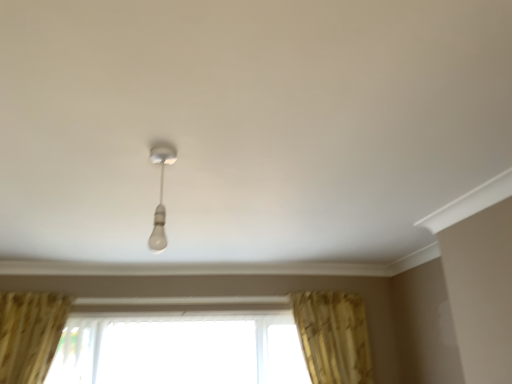
Question: Does white glossy bulb at center have a lesser width compared to transparent glass window at center?

Choices:
 (A) no
 (B) yes

Answer: (B)

Question: Considering the relative positions of white glossy bulb at center and transparent glass window at center in the image provided, is white glossy bulb at center in front of transparent glass window at center?

Choices:
 (A) no
 (B) yes

Answer: (B)

Question: Are white glossy bulb at center and transparent glass window at center making contact?

Choices:
 (A) yes
 (B) no

Answer: (B)

Question: Is white glossy bulb at center behind transparent glass window at center?

Choices:
 (A) no
 (B) yes

Answer: (A)

Question: From the image's perspective, would you say white glossy bulb at center is positioned over transparent glass window at center?

Choices:
 (A) yes
 (B) no

Answer: (A)

Question: Considering the relative sizes of white glossy bulb at center and transparent glass window at center in the image provided, is white glossy bulb at center taller than transparent glass window at center?

Choices:
 (A) yes
 (B) no

Answer: (B)

Question: Considering the relative sizes of transparent glass window at center and gold textured curtain at lower right in the image provided, is transparent glass window at center wider than gold textured curtain at lower right?

Choices:
 (A) no
 (B) yes

Answer: (A)

Question: Is transparent glass window at center positioned with its back to gold textured curtain at lower right?

Choices:
 (A) no
 (B) yes

Answer: (A)

Question: From the image's perspective, is transparent glass window at center under gold textured curtain at lower right?

Choices:
 (A) yes
 (B) no

Answer: (A)

Question: Is transparent glass window at center in contact with gold textured curtain at lower right?

Choices:
 (A) no
 (B) yes

Answer: (A)

Question: Is transparent glass window at center facing towards gold textured curtain at lower right?

Choices:
 (A) no
 (B) yes

Answer: (B)

Question: Could gold textured curtain at lower right be considered to be inside transparent glass window at center?

Choices:
 (A) no
 (B) yes

Answer: (A)

Question: Is white glossy bulb at center turned away from gold textured curtain at lower right?

Choices:
 (A) no
 (B) yes

Answer: (A)